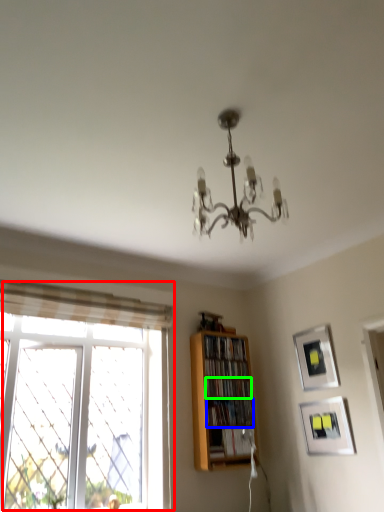
Question: Which object is positioned farthest from window (highlighted by a red box)? Select from book (highlighted by a blue box) and book (highlighted by a green box).

Choices:
 (A) book
 (B) book

Answer: (B)